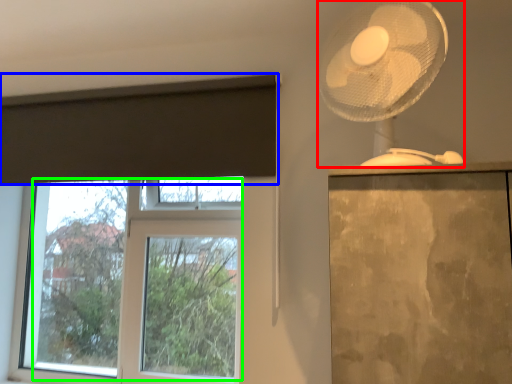
Question: Considering the real-world distances, which object is closest to mechanical fan (highlighted by a red box)? curtain (highlighted by a blue box) or bay window (highlighted by a green box).

Choices:
 (A) curtain
 (B) bay window

Answer: (A)